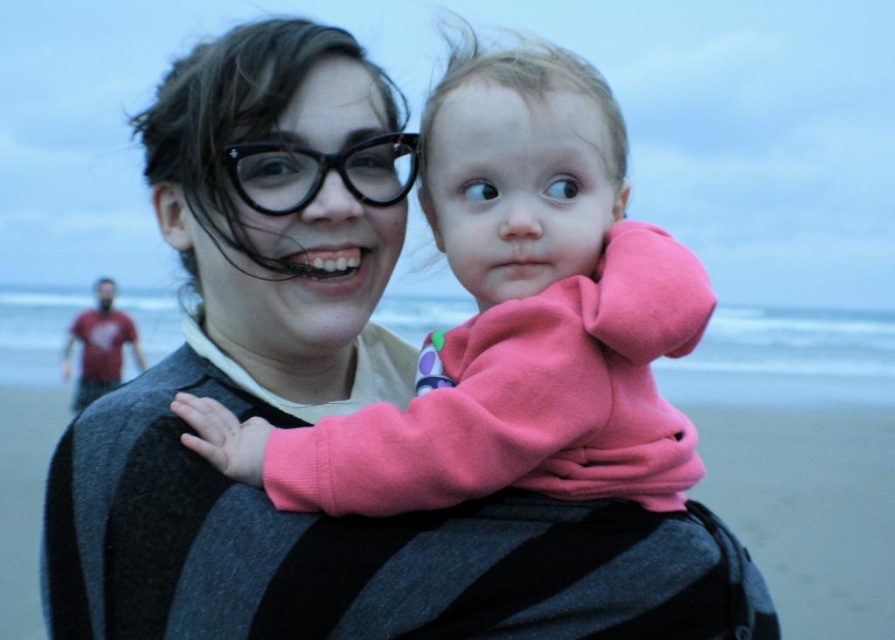
Question: Does matte black sweater at center appear over pink fleece at center?

Choices:
 (A) yes
 (B) no

Answer: (B)

Question: Is matte black sweater at center thinner than pink fleece at center?

Choices:
 (A) yes
 (B) no

Answer: (A)

Question: Which of the following is the closest to the observer?

Choices:
 (A) (331, 429)
 (B) (69, 490)

Answer: (A)

Question: Is matte black sweater at center smaller than pink fleece at center?

Choices:
 (A) no
 (B) yes

Answer: (A)